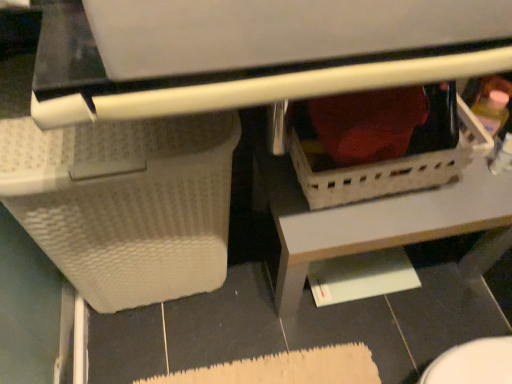
Question: Based on their positions, is white textured basket at lower left, which appears as the second basket when viewed from the right, located to the left or right of white plastic basket at center, the 2th basket when ordered from left to right?

Choices:
 (A) right
 (B) left

Answer: (B)

Question: Does point coord(102,264) appear closer or farther from the camera than point coord(473,135)?

Choices:
 (A) closer
 (B) farther

Answer: (B)

Question: Based on their relative distances, which object is nearer to the white plastic basket at lower center?

Choices:
 (A) white plastic basket at center, positioned as the first basket in right-to-left order
 (B) black glossy tile at lower right
 (C) white textured basket at lower left, which appears as the second basket when viewed from the right

Answer: (A)

Question: Which object is positioned farthest from the white textured basket at lower left, marked as the first basket in a left-to-right arrangement?

Choices:
 (A) white plastic basket at lower center
 (B) black glossy tile at lower right
 (C) white plastic basket at center, positioned as the first basket in right-to-left order

Answer: (B)